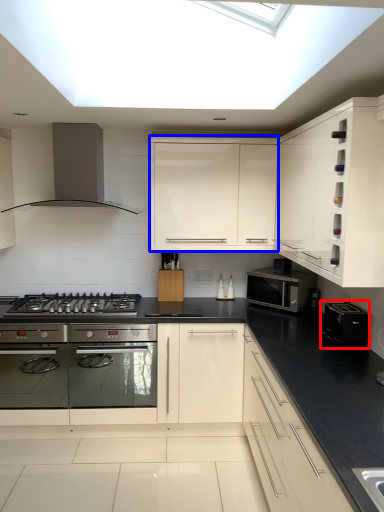
Question: Among these objects, which one is farthest to the camera, appliance (highlighted by a red box) or cabinetry (highlighted by a blue box)?

Choices:
 (A) appliance
 (B) cabinetry

Answer: (B)